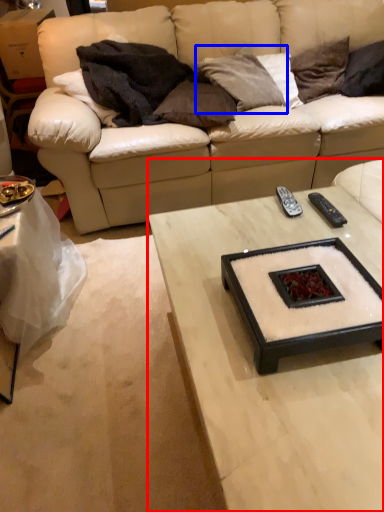
Question: Which point is closer to the camera, coffee table (highlighted by a red box) or pillow (highlighted by a blue box)?

Choices:
 (A) coffee table
 (B) pillow

Answer: (A)